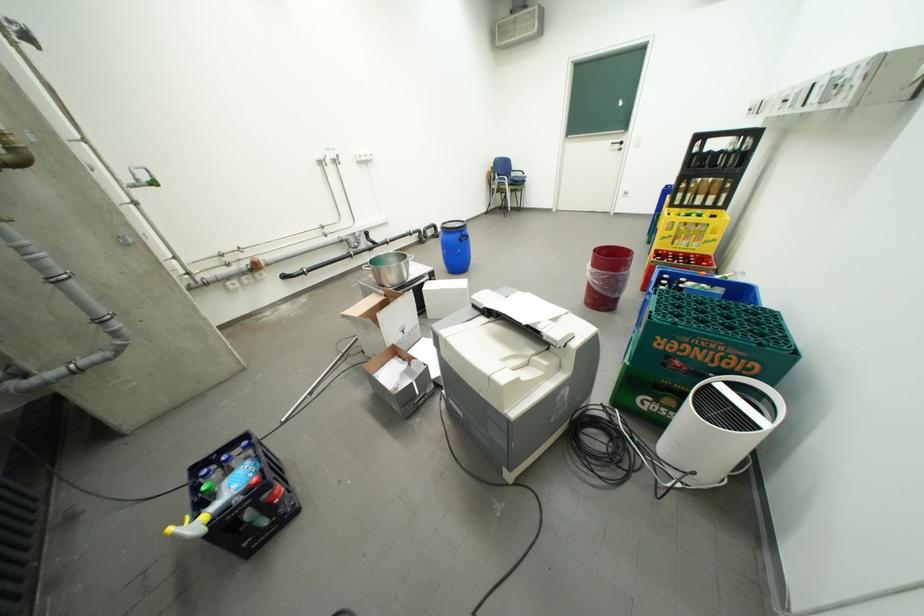
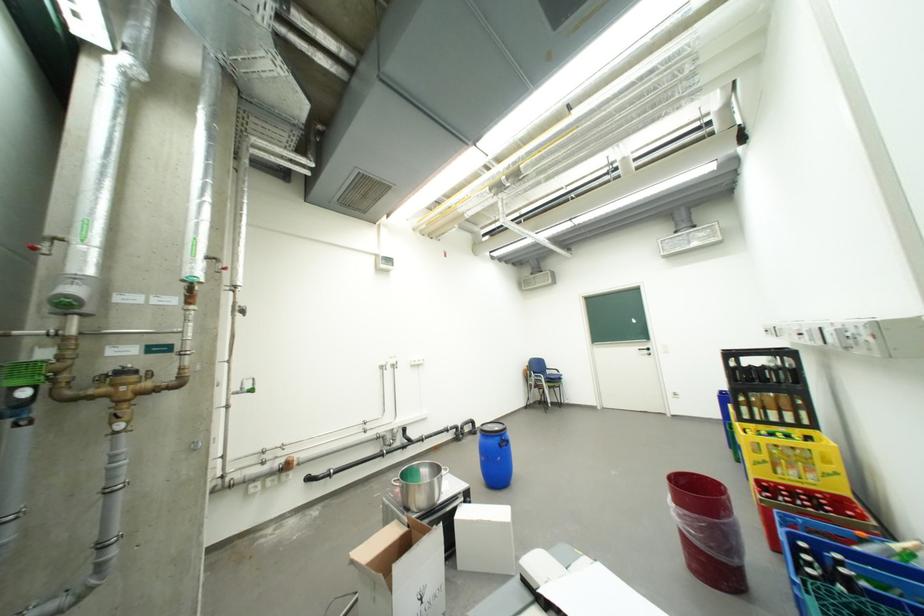
Where in the second image is the point corresponding to the point at 602,269 from the first image?

(685, 507)